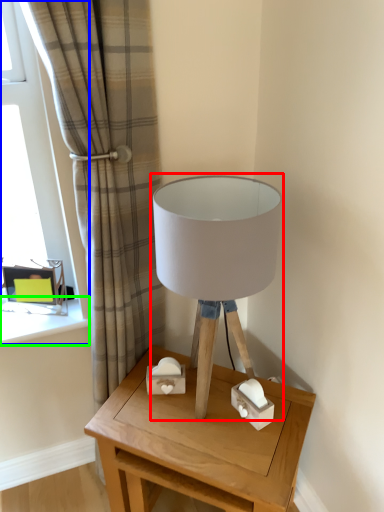
Question: Based on their relative distances, which object is farther from lamp (highlighted by a red box)? Choose from window (highlighted by a blue box) and window sill (highlighted by a green box).

Choices:
 (A) window
 (B) window sill

Answer: (B)